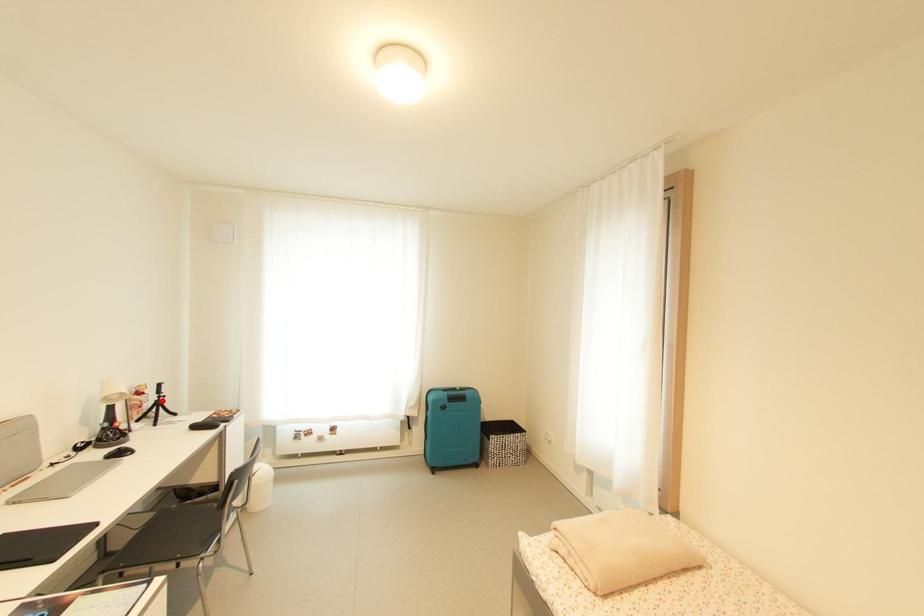
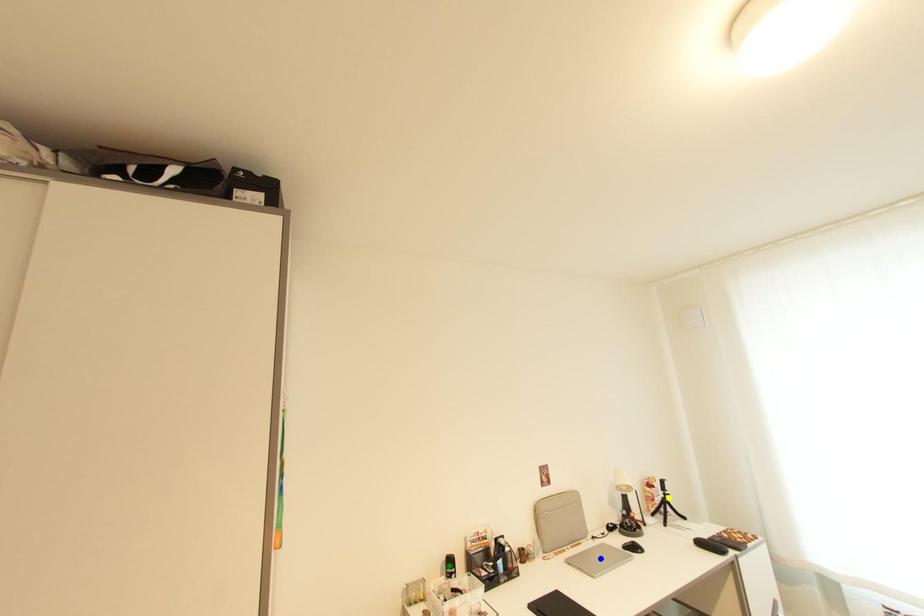
Question: I am providing you with two images of the same scene from different viewpoints. A red point is marked on the first image. You are given multiple points on the second image. Can you choose the point in image 2 that corresponds to the point in image 1?

Choices:
 (A) blue point
 (B) yellow point
 (C) green point

Answer: (B)